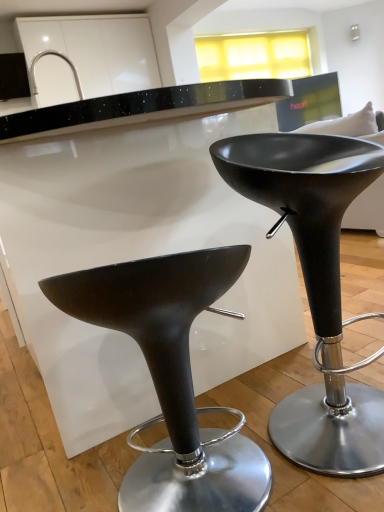
Question: Should I look upward or downward to see matte black stool at center, the 1th stool in the right-to-left sequence?

Choices:
 (A) up
 (B) down

Answer: (B)

Question: From a real-world perspective, is satin nickel faucet at upper left physically below matte black stool at lower left, marked as the 1th stool in a left-to-right arrangement?

Choices:
 (A) yes
 (B) no

Answer: (B)

Question: Is satin nickel faucet at upper left aimed at matte black stool at lower left, which ranks as the second stool in right-to-left order?

Choices:
 (A) no
 (B) yes

Answer: (A)

Question: Is the position of satin nickel faucet at upper left more distant than that of matte black stool at lower left, which ranks as the second stool in right-to-left order?

Choices:
 (A) yes
 (B) no

Answer: (A)

Question: Is satin nickel faucet at upper left to the left of matte black stool at lower left, marked as the 1th stool in a left-to-right arrangement, from the viewer's perspective?

Choices:
 (A) yes
 (B) no

Answer: (A)

Question: From the image's perspective, is satin nickel faucet at upper left located beneath matte black stool at lower left, which ranks as the second stool in right-to-left order?

Choices:
 (A) no
 (B) yes

Answer: (A)

Question: Is satin nickel faucet at upper left not inside matte black stool at lower left, which ranks as the second stool in right-to-left order?

Choices:
 (A) no
 (B) yes

Answer: (B)

Question: Can you confirm if satin nickel faucet at upper left is taller than matte black stool at center, acting as the second stool starting from the left?

Choices:
 (A) yes
 (B) no

Answer: (B)

Question: Is satin nickel faucet at upper left behind matte black stool at center, acting as the second stool starting from the left?

Choices:
 (A) no
 (B) yes

Answer: (B)

Question: Is satin nickel faucet at upper left oriented away from matte black stool at center, the 1th stool in the right-to-left sequence?

Choices:
 (A) no
 (B) yes

Answer: (A)

Question: Are satin nickel faucet at upper left and matte black stool at center, the 1th stool in the right-to-left sequence, located far from each other?

Choices:
 (A) no
 (B) yes

Answer: (B)

Question: Is satin nickel faucet at upper left touching matte black stool at center, the 1th stool in the right-to-left sequence?

Choices:
 (A) no
 (B) yes

Answer: (A)

Question: Is matte black stool at center, acting as the second stool starting from the left, inside satin nickel faucet at upper left?

Choices:
 (A) yes
 (B) no

Answer: (B)

Question: Is matte black stool at lower left, which ranks as the second stool in right-to-left order, positioned before satin nickel faucet at upper left?

Choices:
 (A) yes
 (B) no

Answer: (A)